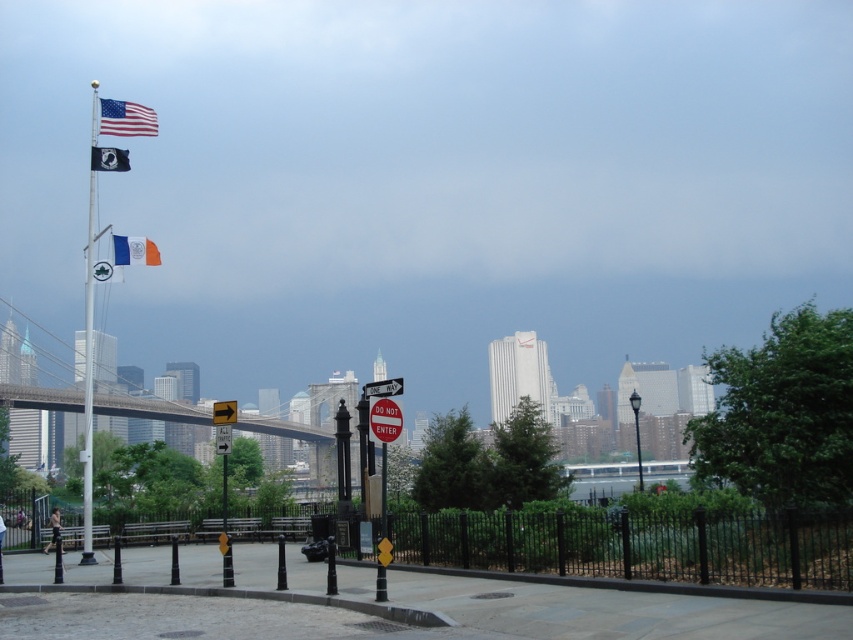
You are a park visitor who wants to hang a new flag on the flagpole. The flagpole currently has the matte fabric flag at upper left and the blue fabric flag at upper left. Which flag is higher up on the flagpole?

The matte fabric flag at upper left is much taller than the blue fabric flag at upper left, so the matte fabric flag at upper left is higher up on the flagpole.

You are standing at the point with coordinates point (88, 380) in the park. What object are you standing next to?

You are standing next to the white metallic flag pole at left.

You are a city planner designing a new park layout. You need to ensure that the white metallic flag pole at left does not block the view of the city skyline from the pedestrian walkway. Given the possible width of the flag pole compared to the blue fabric flag at upper left, what should you consider when positioning the flag pole?

Since the white metallic flag pole at left might be wider than the blue fabric flag at upper left, you should position it in a way that its width does not obstruct the view to the skyline, possibly by angling it or placing it slightly off the central path.